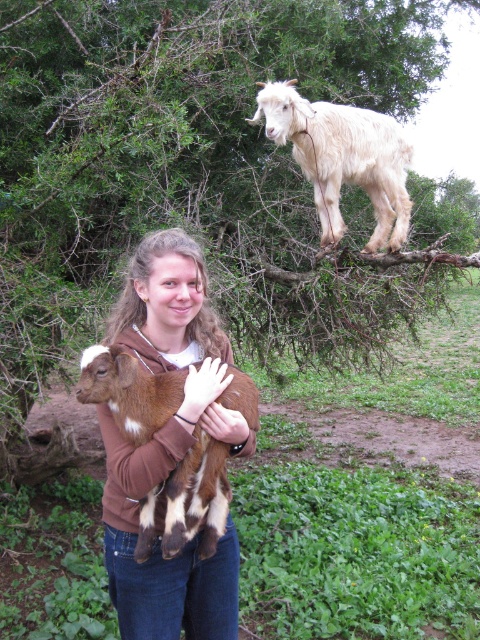
Question: Considering the relative positions of white woolen goat at upper center and brown leather glove at center in the image provided, where is white woolen goat at upper center located with respect to brown leather glove at center?

Choices:
 (A) left
 (B) right

Answer: (B)

Question: Which point is closer to the camera taking this photo?

Choices:
 (A) [225, 417]
 (B) [153, 371]
 (C) [360, 128]

Answer: (A)

Question: Can you confirm if white woolen goat at upper center is positioned below white matte glove at center?

Choices:
 (A) no
 (B) yes

Answer: (A)

Question: Which object is the closest to the white matte glove at center?

Choices:
 (A) brown soft fur at center
 (B) white woolen goat at upper center

Answer: (A)

Question: Can you confirm if white matte glove at center is thinner than brown leather glove at center?

Choices:
 (A) yes
 (B) no

Answer: (B)

Question: Based on their relative distances, which object is farther from the brown leather glove at center?

Choices:
 (A) white matte glove at center
 (B) brown soft fur at center

Answer: (B)